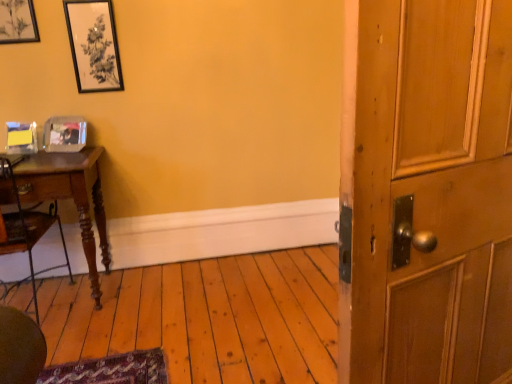
Question: Visually, is matte black picture frame at upper left, the 3th picture frame ordered from the bottom, positioned to the left or to the right of black matte picture frame at upper left, which ranks as the 2th picture frame in top-to-bottom order?

Choices:
 (A) right
 (B) left

Answer: (B)

Question: Do you think matte black picture frame at upper left, the 3th picture frame ordered from the bottom, is within black matte picture frame at upper left, arranged as the second picture frame when ordered from the bottom, or outside of it?

Choices:
 (A) outside
 (B) inside

Answer: (A)

Question: Estimate the real-world distances between objects in this image. Which object is farther from the black matte picture frame at upper left, which ranks as the 2th picture frame in top-to-bottom order?

Choices:
 (A) wooden barn door at right
 (B) wooden desk at left
 (C) matte black picture frame at upper left, the 1th picture frame from the top
 (D) clear plastic picture frame at left, which is the third picture frame in top-to-bottom order

Answer: (A)

Question: Based on their relative distances, which object is nearer to the wooden desk at left?

Choices:
 (A) matte black picture frame at upper left, the 3th picture frame ordered from the bottom
 (B) wooden barn door at right
 (C) clear plastic picture frame at left, which is the third picture frame in top-to-bottom order
 (D) black matte picture frame at upper left, which ranks as the 2th picture frame in top-to-bottom order

Answer: (C)